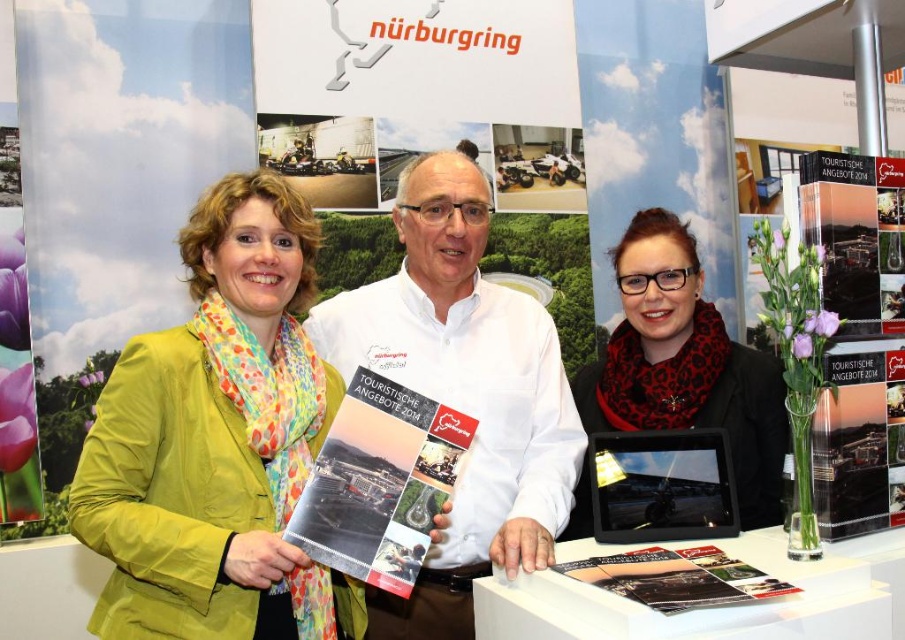
What is the position of the point labeled with coordinates (463, 392) in relation to the white paper at center?

The point labeled with coordinates (463, 392) is located on the white paper at center.

You are a visitor at the Nurburgring exhibition booth. You see the green fabric jacket at left and the matte paper brochure at center. Which item is closer to you?

The green fabric jacket at left is closer to you since it is in front of the matte paper brochure at center.